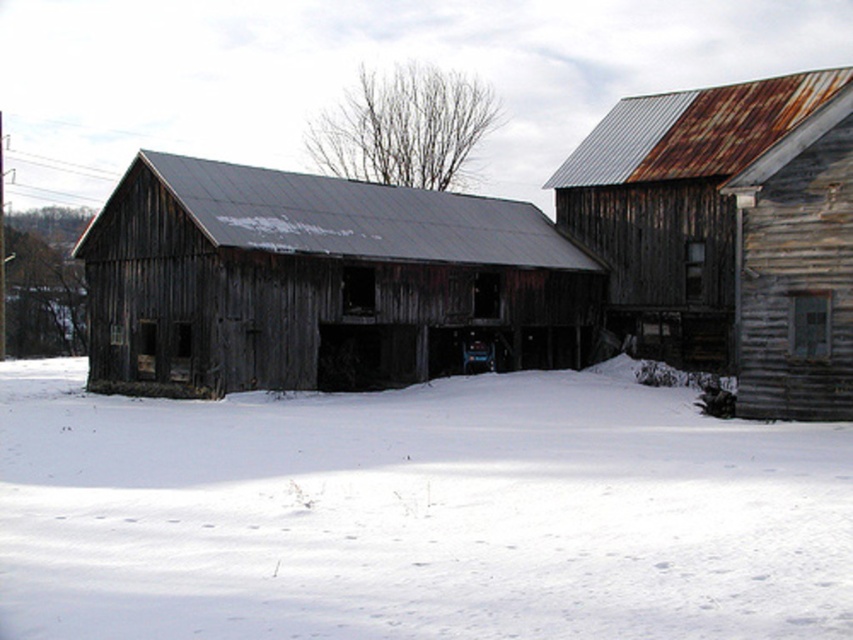
Which is behind, point (593, 618) or point (294, 316)?

The point (294, 316) is more distant.

Does white powdery snow at center have a smaller size compared to rusty wood barn at center?

Yes.

Which is in front, point (96, 611) or point (200, 164)?

Point (96, 611) is more forward.

Locate an element on the screen. white powdery snow at center is located at coordinates (416, 515).

Can you confirm if rusty wood barn at center is wider than rusty metal hut at upper right?

Yes, rusty wood barn at center is wider than rusty metal hut at upper right.

Does rusty wood barn at center have a smaller size compared to rusty metal hut at upper right?

Yes, rusty wood barn at center is smaller than rusty metal hut at upper right.

Who is more distant from viewer, (212, 355) or (770, 348)?

The point (212, 355) is behind.

This screenshot has height=640, width=853. What are the coordinates of `rusty wood barn at center` in the screenshot? It's located at (317, 282).

Which of these two, white powdery snow at center or rusty metal hut at upper right, stands shorter?

white powdery snow at center is shorter.

Which is more to the left, white powdery snow at center or rusty metal hut at upper right?

Positioned to the left is white powdery snow at center.

Where is `white powdery snow at center`? The width and height of the screenshot is (853, 640). white powdery snow at center is located at coordinates point(416,515).

The image size is (853, 640). I want to click on white powdery snow at center, so click(x=416, y=515).